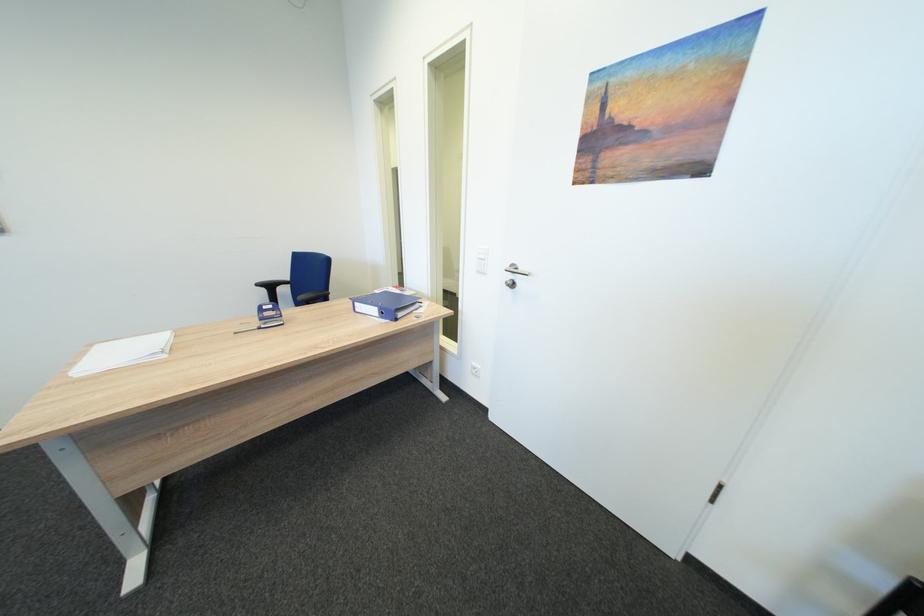
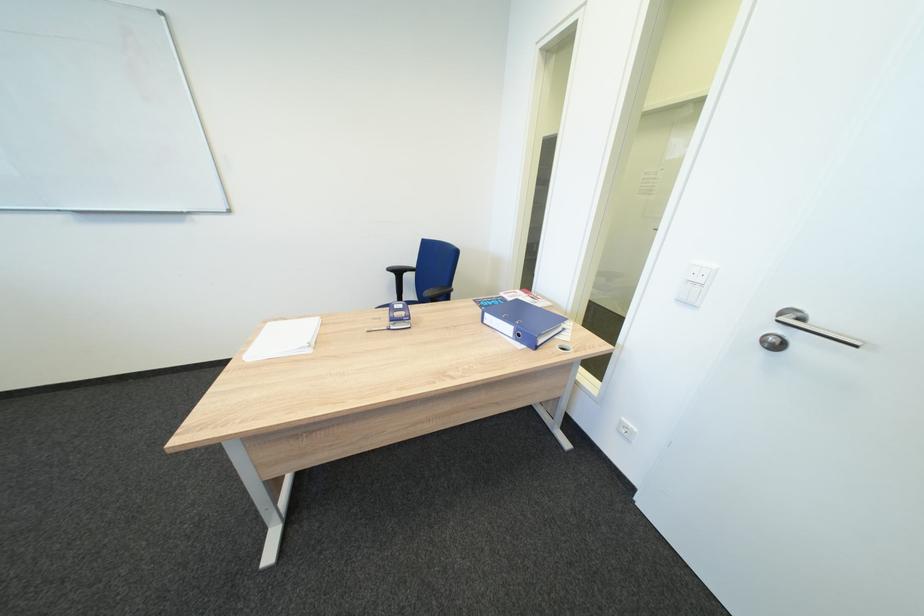
Where in the second image is the point corresponding to point 488,273 from the first image?

(687, 302)